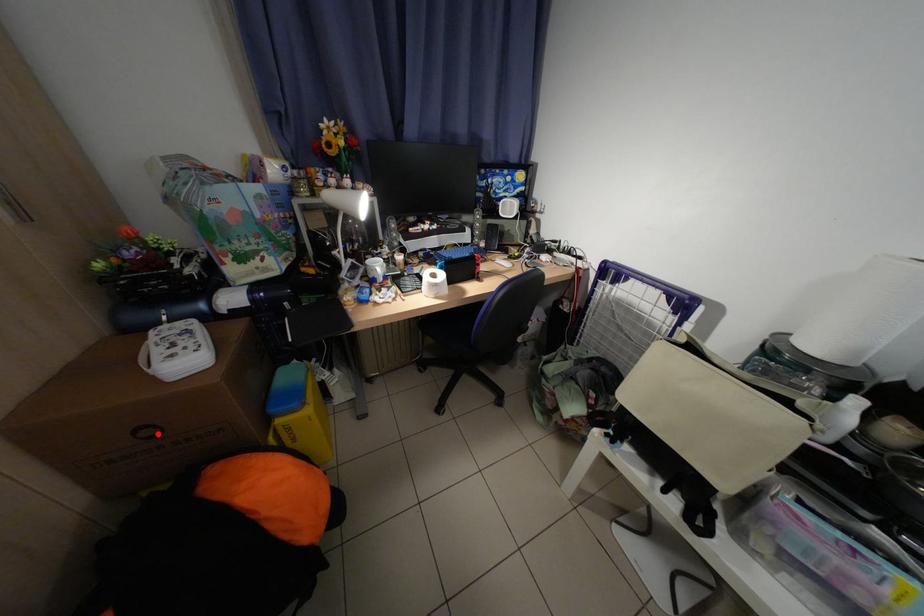
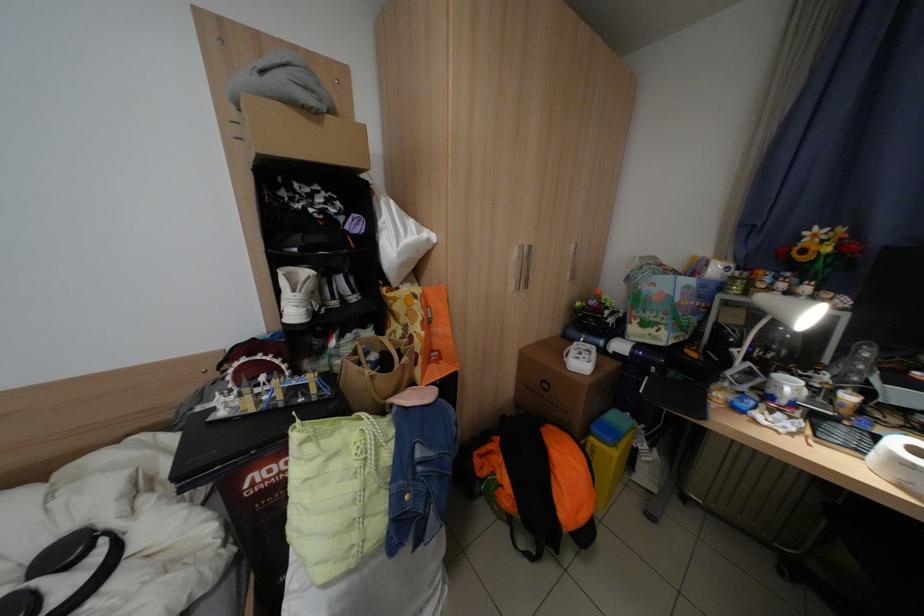
Question: I am providing you with two images of the same scene from different viewpoints. Given a red point in image1, look at the same physical point in image2. Is it:

Choices:
 (A) Closer to the viewpoint
 (B) Farther from the viewpoint

Answer: (B)